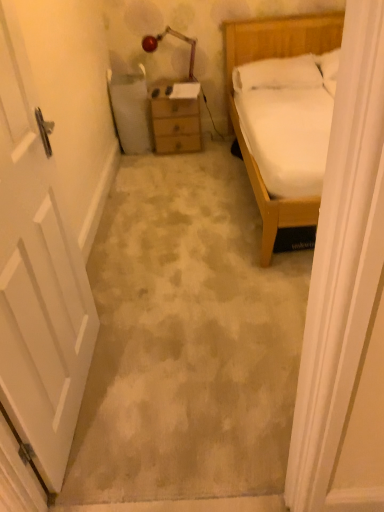
This screenshot has width=384, height=512. I want to click on vacant space to the right of white matte door at left, so click(180, 382).